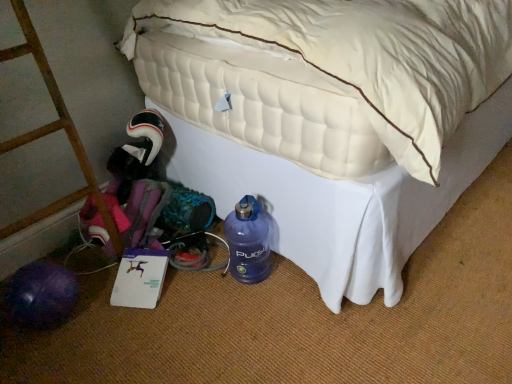
Find the location of a particular element. The image size is (512, 384). brushed metal ladder at left is located at coordinates (51, 133).

What is the approximate height of white quilted mattress at lower left?

33.06 inches.

Locate an element on the screen. The image size is (512, 384). blue matte water bottle at lower center is located at coordinates (248, 242).

Consider the image. From the image's perspective, is blue matte water bottle at lower center beneath brushed metal ladder at left?

Yes, from the image's perspective, blue matte water bottle at lower center is below brushed metal ladder at left.

Between blue matte water bottle at lower center and brushed metal ladder at left, which one has less height?

With less height is blue matte water bottle at lower center.

What's the angular difference between blue matte water bottle at lower center and brushed metal ladder at left's facing directions?

The angle between the facing direction of blue matte water bottle at lower center and the facing direction of brushed metal ladder at left is 91.4 degrees.

Measure the distance between blue matte water bottle at lower center and brushed metal ladder at left.

The distance of blue matte water bottle at lower center from brushed metal ladder at left is 19.58 inches.

Can you confirm if white quilted mattress at lower left is positioned to the left of blue matte water bottle at lower center?

In fact, white quilted mattress at lower left is to the right of blue matte water bottle at lower center.

From the image's perspective, does white quilted mattress at lower left appear lower than blue matte water bottle at lower center?

No.

From a real-world perspective, who is located higher, white quilted mattress at lower left or blue matte water bottle at lower center?

white quilted mattress at lower left, from a real-world perspective.

Is white quilted mattress at lower left facing away from blue matte water bottle at lower center?

white quilted mattress at lower left is not turned away from blue matte water bottle at lower center.

Which object is further away from the camera, blue matte water bottle at lower center or white quilted mattress at lower left?

blue matte water bottle at lower center is further away from the camera.

Choose the correct answer: Is blue matte water bottle at lower center inside white quilted mattress at lower left or outside it?

The correct answer is: inside.

Is blue matte water bottle at lower center touching white quilted mattress at lower left?

There is a gap between blue matte water bottle at lower center and white quilted mattress at lower left.

From the picture: Is white quilted mattress at lower left thinner than brushed metal ladder at left?

No, white quilted mattress at lower left is not thinner than brushed metal ladder at left.

Is white quilted mattress at lower left oriented away from brushed metal ladder at left?

That's not correct — white quilted mattress at lower left is not looking away from brushed metal ladder at left.

Who is taller, white quilted mattress at lower left or brushed metal ladder at left?

Standing taller between the two is white quilted mattress at lower left.

From a real-world perspective, is brushed metal ladder at left located beneath blue matte water bottle at lower center?

No, from a real-world perspective, brushed metal ladder at left is not beneath blue matte water bottle at lower center.

Is brushed metal ladder at left bigger or smaller than blue matte water bottle at lower center?

Considering their sizes, brushed metal ladder at left takes up more space than blue matte water bottle at lower center.

Between brushed metal ladder at left and blue matte water bottle at lower center, which one has larger width?

brushed metal ladder at left is wider.

Is brushed metal ladder at left far from white quilted mattress at lower left?

A: brushed metal ladder at left is actually quite close to white quilted mattress at lower left.

Does point (118, 239) lie behind point (252, 145)?

Yes, point (118, 239) is farther from viewer.

From the image's perspective, is brushed metal ladder at left above white quilted mattress at lower left?

Incorrect, from the image's perspective, brushed metal ladder at left is lower than white quilted mattress at lower left.

Who is bigger, brushed metal ladder at left or white quilted mattress at lower left?

Bigger between the two is white quilted mattress at lower left.

Find the location of a particular element. ladder that appears on the left of blue matte water bottle at lower center is located at coordinates (51, 133).

Locate an element on the screen. This screenshot has width=512, height=384. bed lying above the blue matte water bottle at lower center (from the image's perspective) is located at coordinates (332, 117).

Based on their spatial positions, is white quilted mattress at lower left or blue matte water bottle at lower center further from brushed metal ladder at left?

white quilted mattress at lower left is further to brushed metal ladder at left.

Which object lies nearer to the anchor point white quilted mattress at lower left, brushed metal ladder at left or blue matte water bottle at lower center?

blue matte water bottle at lower center.

Looking at this image, based on their spatial positions, is blue matte water bottle at lower center or white quilted mattress at lower left further from brushed metal ladder at left?

Among the two, white quilted mattress at lower left is located further to brushed metal ladder at left.

Considering their positions, is white quilted mattress at lower left positioned closer to blue matte water bottle at lower center than brushed metal ladder at left?

white quilted mattress at lower left.

From the image, which object appears to be nearer to white quilted mattress at lower left, blue matte water bottle at lower center or brushed metal ladder at left?

blue matte water bottle at lower center is positioned closer to the anchor white quilted mattress at lower left.

When comparing their distances from blue matte water bottle at lower center, does brushed metal ladder at left or white quilted mattress at lower left seem closer?

white quilted mattress at lower left lies closer to blue matte water bottle at lower center than the other object.

You are a GUI agent. You are given a task and a screenshot of the screen. Output one action in this format:
    pyautogui.click(x=<x>, y=<y>)
    Task: Click on the bottle situated between brushed metal ladder at left and white quilted mattress at lower left from left to right
    
    Given the screenshot: What is the action you would take?
    pyautogui.click(x=248, y=242)